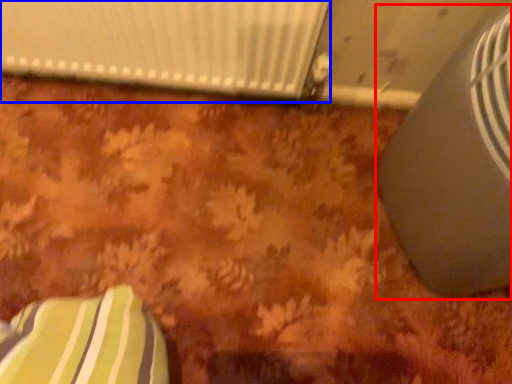
Question: Which point is closer to the camera, air conditioning (highlighted by a red box) or radiator (highlighted by a blue box)?

Choices:
 (A) air conditioning
 (B) radiator

Answer: (A)